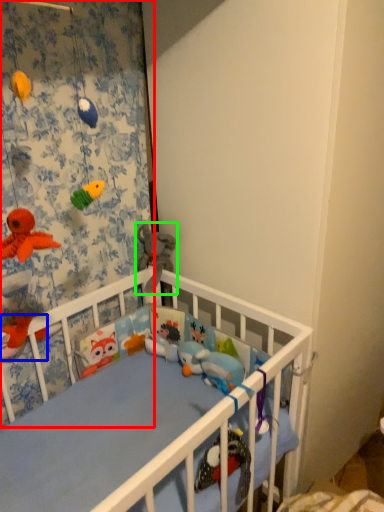
Question: Based on their relative distances, which object is nearer to curtain (highlighted by a red box)? Choose from toy (highlighted by a blue box) and toy (highlighted by a green box).

Choices:
 (A) toy
 (B) toy

Answer: (B)